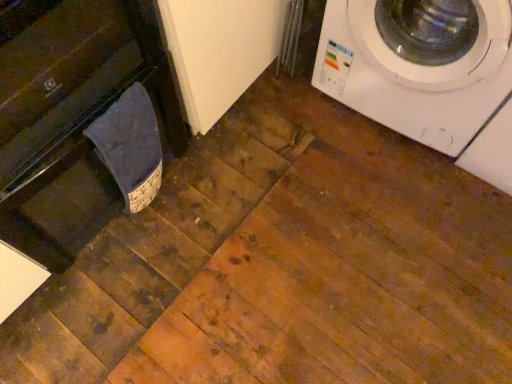
Where is `dark blue fabric at lower left`? The width and height of the screenshot is (512, 384). dark blue fabric at lower left is located at coordinates (130, 146).

What do you see at coordinates (71, 117) in the screenshot? The image size is (512, 384). I see `black glossy dishwasher at left` at bounding box center [71, 117].

Where is `dark blue fabric at lower left`? The image size is (512, 384). dark blue fabric at lower left is located at coordinates (130, 146).

Considering the positions of objects black glossy dishwasher at left and dark blue fabric at lower left in the image provided, who is more to the left, black glossy dishwasher at left or dark blue fabric at lower left?

From the viewer's perspective, black glossy dishwasher at left appears more on the left side.

From a real-world perspective, is black glossy dishwasher at left physically below dark blue fabric at lower left?

No, from a real-world perspective, black glossy dishwasher at left is not beneath dark blue fabric at lower left.

You are a GUI agent. You are given a task and a screenshot of the screen. Output one action in this format:
    pyautogui.click(x=<x>, y=<y>)
    Task: Click on the dish washer in front of the dark blue fabric at lower left
    Image resolution: width=512 pixels, height=384 pixels.
    Given the screenshot: What is the action you would take?
    pyautogui.click(x=71, y=117)

Looking at this image, is dark blue fabric at lower left positioned beyond the bounds of black glossy dishwasher at left?

That's incorrect, dark blue fabric at lower left is not completely outside black glossy dishwasher at left.

Is dark blue fabric at lower left shorter than black glossy dishwasher at left?

Indeed, dark blue fabric at lower left has a lesser height compared to black glossy dishwasher at left.

Considering their positions, is dark blue fabric at lower left located in front of or behind black glossy dishwasher at left?

dark blue fabric at lower left is positioned farther from the viewer than black glossy dishwasher at left.

Is white glossy washing machine at upper right taller than dark blue fabric at lower left?

Yes.

Looking at this image, visually, is white glossy washing machine at upper right positioned to the left or to the right of dark blue fabric at lower left?

From the image, it's evident that white glossy washing machine at upper right is to the right of dark blue fabric at lower left.

From the image's perspective, which one is positioned lower, white glossy washing machine at upper right or dark blue fabric at lower left?

dark blue fabric at lower left appears lower in the image.

Can you confirm if white glossy washing machine at upper right is thinner than dark blue fabric at lower left?

In fact, white glossy washing machine at upper right might be wider than dark blue fabric at lower left.

From the image's perspective, is black glossy dishwasher at left located above white glossy washing machine at upper right?

Incorrect, from the image's perspective, black glossy dishwasher at left is lower than white glossy washing machine at upper right.

Is black glossy dishwasher at left beside white glossy washing machine at upper right?

No, black glossy dishwasher at left is not with white glossy washing machine at upper right.

Considering the positions of objects black glossy dishwasher at left and white glossy washing machine at upper right in the image provided, who is more to the left, black glossy dishwasher at left or white glossy washing machine at upper right?

black glossy dishwasher at left.

Considering the relative positions of black glossy dishwasher at left and white glossy washing machine at upper right in the image provided, is black glossy dishwasher at left in front of white glossy washing machine at upper right?

Yes.

From the image's perspective, which is below, white glossy washing machine at upper right or black glossy dishwasher at left?

From the image's view, black glossy dishwasher at left is below.

Does white glossy washing machine at upper right have a greater width compared to black glossy dishwasher at left?

No.

From the picture: Is white glossy washing machine at upper right bigger or smaller than black glossy dishwasher at left?

In the image, white glossy washing machine at upper right appears to be smaller than black glossy dishwasher at left.

Find the location of a particular element. dish washer that appears on the left of white glossy washing machine at upper right is located at coordinates (71, 117).

From the image's perspective, is dark blue fabric at lower left beneath white glossy washing machine at upper right?

Correct, dark blue fabric at lower left appears lower than white glossy washing machine at upper right in the image.

Looking at this image, which object is positioned more to the left, dark blue fabric at lower left or white glossy washing machine at upper right?

From the viewer's perspective, dark blue fabric at lower left appears more on the left side.

Based on the photo, choose the correct answer: Is dark blue fabric at lower left inside white glossy washing machine at upper right or outside it?

dark blue fabric at lower left is not inside white glossy washing machine at upper right, it's outside.

Could you tell me if dark blue fabric at lower left is facing white glossy washing machine at upper right?

No, dark blue fabric at lower left is not oriented towards white glossy washing machine at upper right.

Locate an element on the screen. The height and width of the screenshot is (384, 512). laundry behind the black glossy dishwasher at left is located at coordinates (130, 146).

In order to click on dish washer on the left of dark blue fabric at lower left in this screenshot , I will do `click(71, 117)`.

Which object lies further to the anchor point white glossy washing machine at upper right, black glossy dishwasher at left or dark blue fabric at lower left?

black glossy dishwasher at left lies further to white glossy washing machine at upper right than the other object.

From the image, which object appears to be farther from dark blue fabric at lower left, black glossy dishwasher at left or white glossy washing machine at upper right?

The object further to dark blue fabric at lower left is white glossy washing machine at upper right.

From the image, which object appears to be farther from white glossy washing machine at upper right, dark blue fabric at lower left or black glossy dishwasher at left?

black glossy dishwasher at left.

From the image, which object appears to be farther from black glossy dishwasher at left, dark blue fabric at lower left or white glossy washing machine at upper right?

white glossy washing machine at upper right is positioned further to the anchor black glossy dishwasher at left.

When comparing their distances from dark blue fabric at lower left, does white glossy washing machine at upper right or black glossy dishwasher at left seem further?

Among the two, white glossy washing machine at upper right is located further to dark blue fabric at lower left.

Looking at the image, which one is located further to black glossy dishwasher at left, white glossy washing machine at upper right or dark blue fabric at lower left?

Among the two, white glossy washing machine at upper right is located further to black glossy dishwasher at left.

You are a GUI agent. You are given a task and a screenshot of the screen. Output one action in this format:
    pyautogui.click(x=<x>, y=<y>)
    Task: Click on the laundry between black glossy dishwasher at left and white glossy washing machine at upper right in the horizontal direction
    The image size is (512, 384).
    Given the screenshot: What is the action you would take?
    pyautogui.click(x=130, y=146)